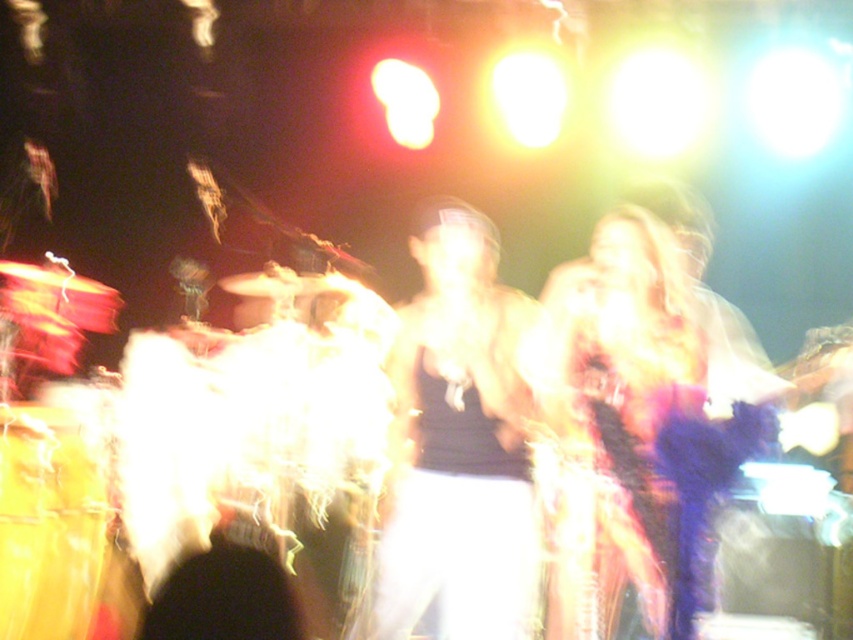
Question: Which object appears closest to the camera in this image?

Choices:
 (A) shiny gold drum at lower left
 (B) shiny purple dress at center

Answer: (B)

Question: Does shiny purple dress at center lie in front of shiny gold drum at lower left?

Choices:
 (A) no
 (B) yes

Answer: (B)

Question: In this image, where is shiny purple dress at center located relative to shiny gold drum at lower left?

Choices:
 (A) right
 (B) left

Answer: (A)

Question: Which point is closer to the camera?

Choices:
 (A) shiny purple dress at center
 (B) shiny gold drum at lower left

Answer: (A)

Question: Considering the relative positions of shiny purple dress at center and shiny gold drum at lower left in the image provided, where is shiny purple dress at center located with respect to shiny gold drum at lower left?

Choices:
 (A) left
 (B) right

Answer: (B)

Question: Among these objects, which one is farthest from the camera?

Choices:
 (A) shiny gold drum at lower left
 (B) shiny purple dress at center

Answer: (A)